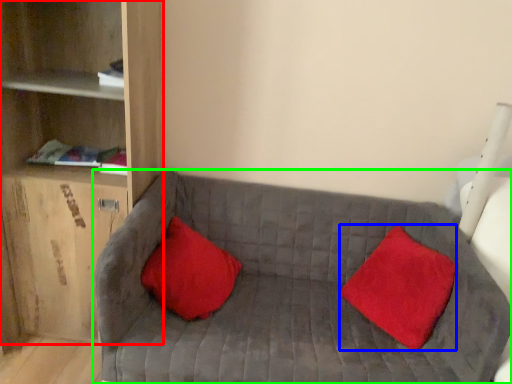
Question: Considering the real-world distances, which object is closest to shelf (highlighted by a red box)? pillow (highlighted by a blue box) or studio couch (highlighted by a green box).

Choices:
 (A) pillow
 (B) studio couch

Answer: (B)